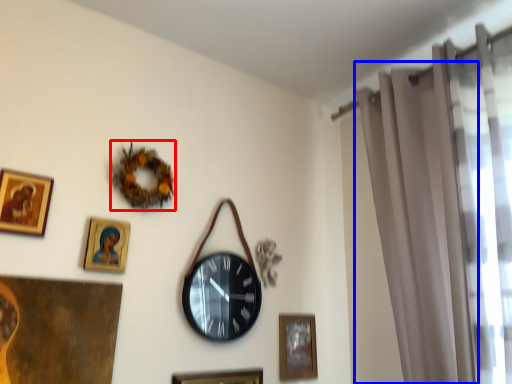
Question: Which point is closer to the camera, decor (highlighted by a red box) or curtain (highlighted by a blue box)?

Choices:
 (A) decor
 (B) curtain

Answer: (B)